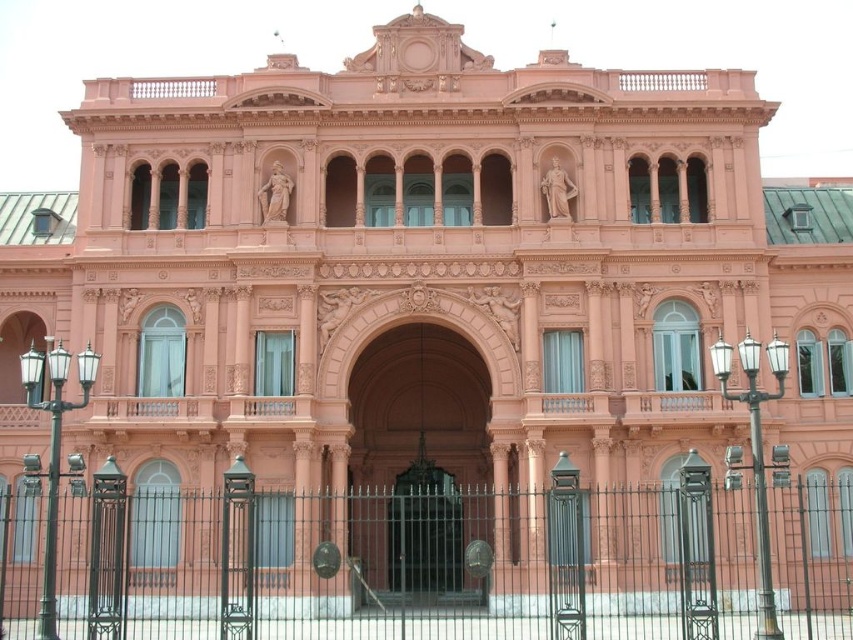
Question: Which of the following is the closest to the observer?

Choices:
 (A) (675, 577)
 (B) (425, 566)

Answer: (A)

Question: Is black wrought iron fence at center wider than polished bronze door at center?

Choices:
 (A) no
 (B) yes

Answer: (B)

Question: Is black wrought iron fence at center wider than polished bronze door at center?

Choices:
 (A) no
 (B) yes

Answer: (B)

Question: From the image, what is the correct spatial relationship of black wrought iron fence at center in relation to polished bronze door at center?

Choices:
 (A) above
 (B) below

Answer: (B)

Question: Which object is closer to the camera taking this photo?

Choices:
 (A) polished bronze door at center
 (B) black wrought iron fence at center

Answer: (B)